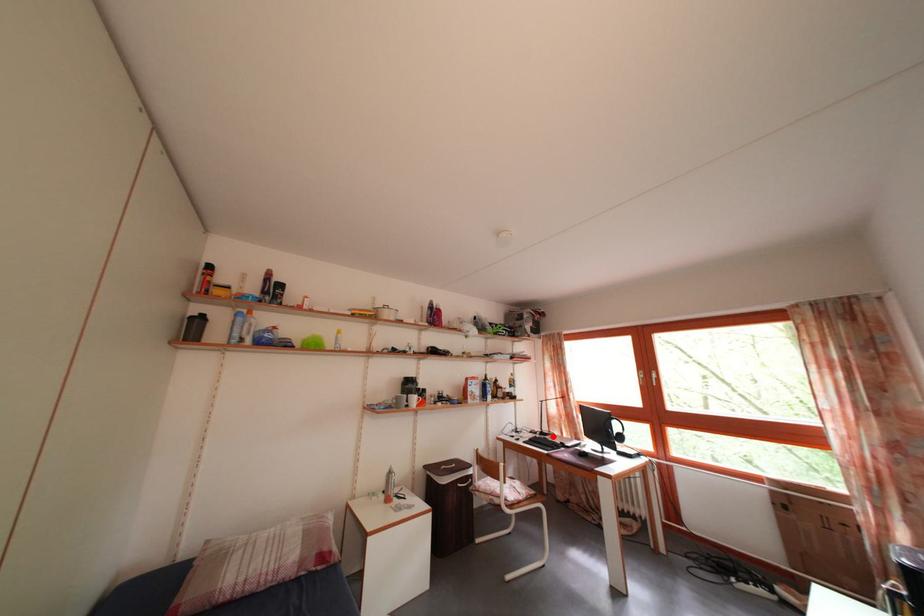
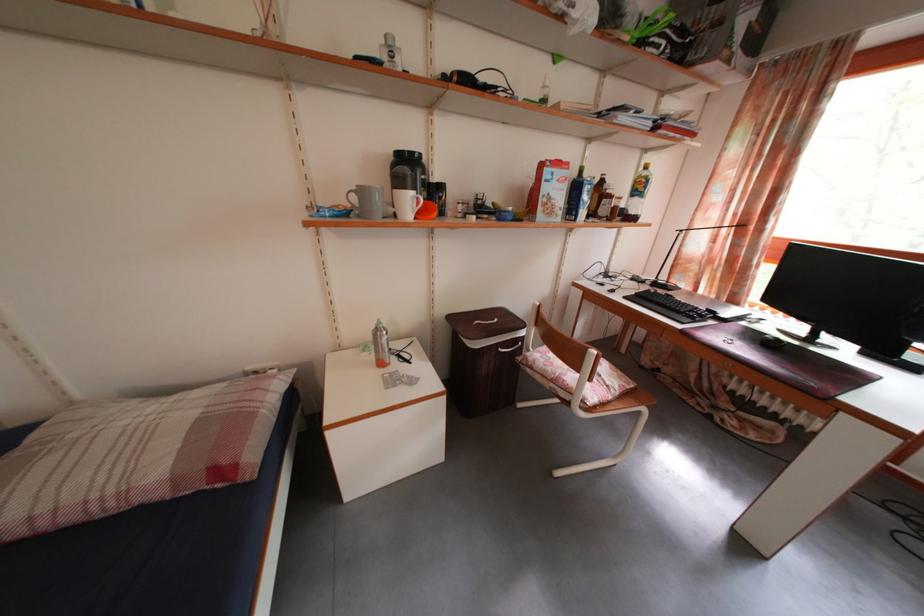
Question: I am providing you with two images of the same scene from different viewpoints. In image1, a red point is highlighted. Considering the same 3D point in image2, which of the following is correct?

Choices:
 (A) It is closer
 (B) It is farther

Answer: (A)